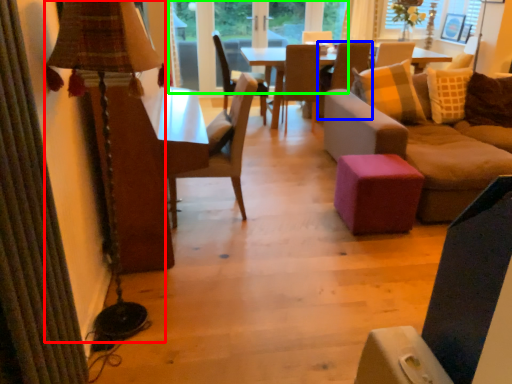
Question: Estimate the real-world distances between objects in this image. Which object is closer to table lamp (highlighted by a red box), chair (highlighted by a blue box) or window frame (highlighted by a green box)?

Choices:
 (A) chair
 (B) window frame

Answer: (A)